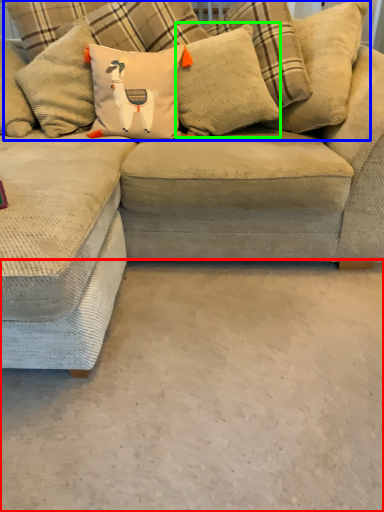
Question: Which object is the farthest from concrete (highlighted by a red box)? Choose among these: pillow (highlighted by a blue box) or pillow (highlighted by a green box).

Choices:
 (A) pillow
 (B) pillow

Answer: (A)